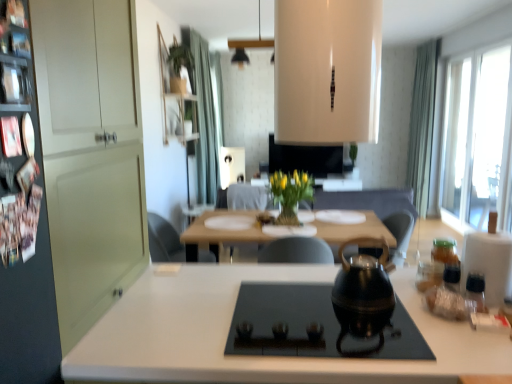
Question: From a real-world perspective, is transparent glass window at right over transparent plastic jar at right, the 3th bottle positioned from the front?

Choices:
 (A) no
 (B) yes

Answer: (B)

Question: From the image's perspective, would you say transparent glass window at right is shown under transparent plastic jar at right, acting as the first bottle starting from the back?

Choices:
 (A) no
 (B) yes

Answer: (A)

Question: Is transparent glass window at right positioned before transparent plastic jar at right, acting as the first bottle starting from the back?

Choices:
 (A) no
 (B) yes

Answer: (A)

Question: From the image's perspective, would you say transparent glass window at right is positioned over transparent plastic jar at right, the 3th bottle positioned from the front?

Choices:
 (A) yes
 (B) no

Answer: (A)

Question: Considering the relative sizes of transparent glass window at right and transparent plastic jar at right, acting as the first bottle starting from the back, in the image provided, is transparent glass window at right wider than transparent plastic jar at right, acting as the first bottle starting from the back,?

Choices:
 (A) yes
 (B) no

Answer: (B)

Question: Is green fabric curtain at upper center, which is counted as the first curtain, starting from the left, taller or shorter than yellow matte vase at center?

Choices:
 (A) tall
 (B) short

Answer: (A)

Question: Considering their positions, is green fabric curtain at upper center, which is counted as the first curtain, starting from the left, located in front of or behind yellow matte vase at center?

Choices:
 (A) behind
 (B) front

Answer: (A)

Question: Is green fabric curtain at upper center, acting as the second curtain starting from the right, wider or thinner than yellow matte vase at center?

Choices:
 (A) wide
 (B) thin

Answer: (B)

Question: Is point (214, 157) closer or farther from the camera than point (271, 177)?

Choices:
 (A) closer
 (B) farther

Answer: (B)

Question: From a real-world perspective, relative to clear glass vase at center, is green fabric curtain at upper right, the 1th curtain viewed from the right, vertically above or below?

Choices:
 (A) above
 (B) below

Answer: (A)

Question: From the image's perspective, relative to clear glass vase at center, is green fabric curtain at upper right, which appears as the 2th curtain when viewed from the left, above or below?

Choices:
 (A) above
 (B) below

Answer: (A)

Question: In terms of size, does green fabric curtain at upper right, which appears as the 2th curtain when viewed from the left, appear bigger or smaller than clear glass vase at center?

Choices:
 (A) small
 (B) big

Answer: (B)

Question: Is green fabric curtain at upper right, which appears as the 2th curtain when viewed from the left, inside or outside of clear glass vase at center?

Choices:
 (A) outside
 (B) inside

Answer: (A)

Question: In the image, is transparent plastic jar at right, the 3th bottle positioned from the front, positioned in front of or behind wooden table at center?

Choices:
 (A) front
 (B) behind

Answer: (A)

Question: Considering the positions of transparent plastic jar at right, acting as the first bottle starting from the back, and wooden table at center in the image, is transparent plastic jar at right, acting as the first bottle starting from the back, wider or thinner than wooden table at center?

Choices:
 (A) thin
 (B) wide

Answer: (A)